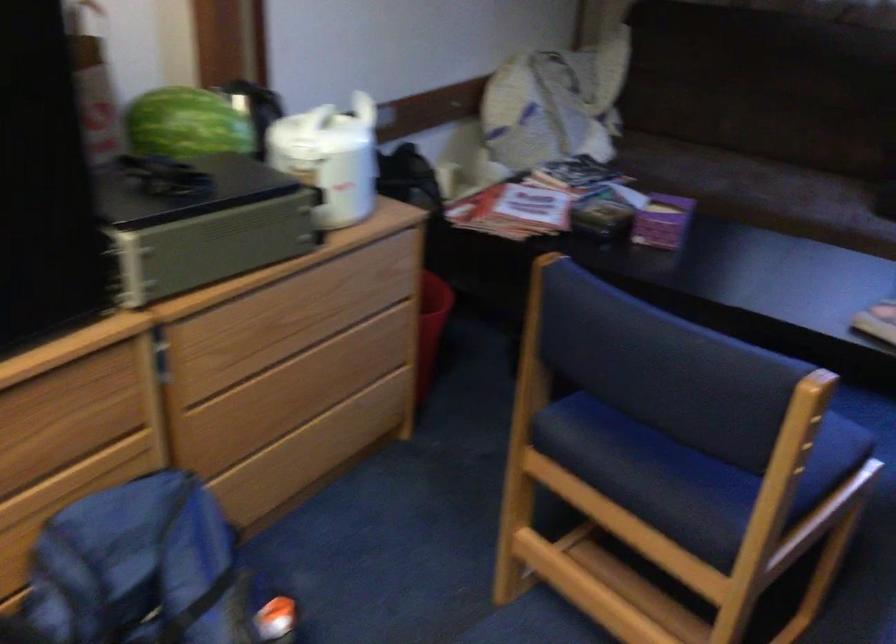
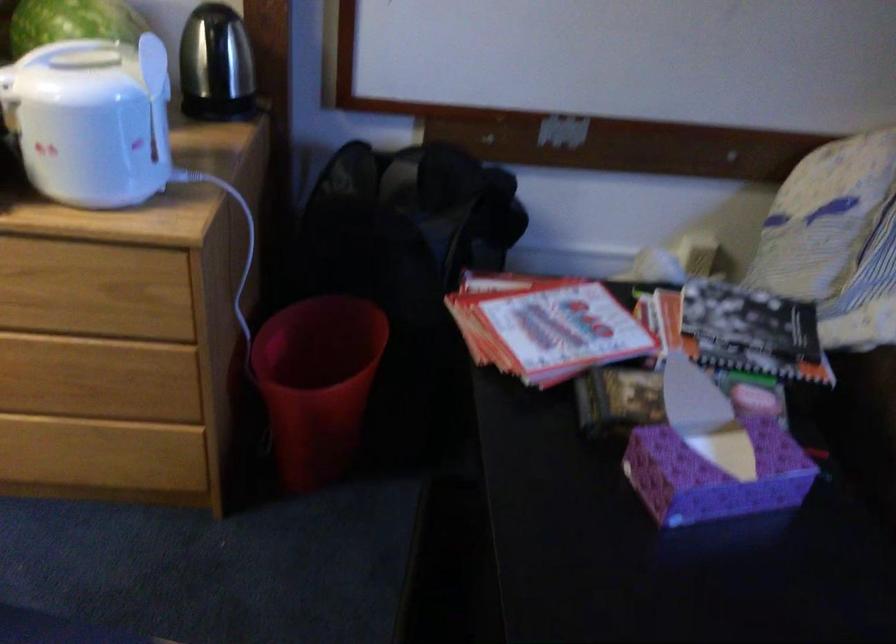
In the second image, find the point that corresponds to point 355,156 in the first image.

(91, 120)